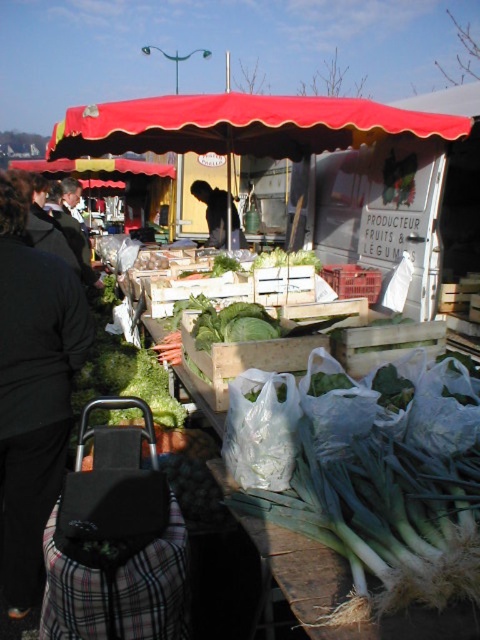
You are a customer at the market and want to pick up the black fabric bag at lower left. Will you have to walk under the red fabric canopy at upper center to reach it?

The black fabric bag at lower left is located below the red fabric canopy at upper center, so yes, you will have to walk under the red fabric canopy at upper center to reach it.

You are standing at the market stall and want to pick up an item. There are two points marked in the image. Which point is closer to you, point (x=225, y=314) or point (x=226, y=198)?

Point (x=225, y=314) is closer to the camera than point (x=226, y=198), so it is closer to you.

You are a customer at the market and want to pick up an item from the stall. There are two points on the table where items are placed. One is at point (0,273) and the other at point (287,131). Which point is closer to you so you can reach it easily?

The point at (0,273) is closer to the viewer than point (287,131), so you can reach it easily.